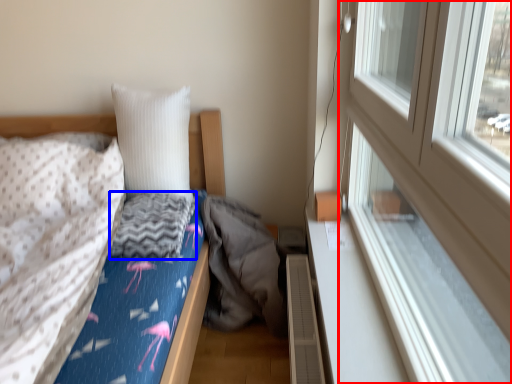
Question: Which of the following is the farthest to the observer, window (highlighted by a red box) or material (highlighted by a blue box)?

Choices:
 (A) window
 (B) material

Answer: (B)